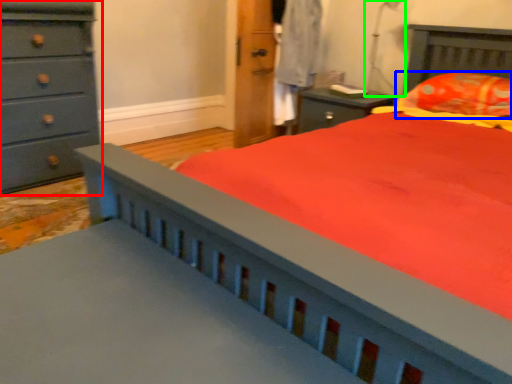
Question: Based on their relative distances, which object is farther from chest of drawers (highlighted by a red box)? Choose from pillow (highlighted by a blue box) and table lamp (highlighted by a green box).

Choices:
 (A) pillow
 (B) table lamp

Answer: (A)